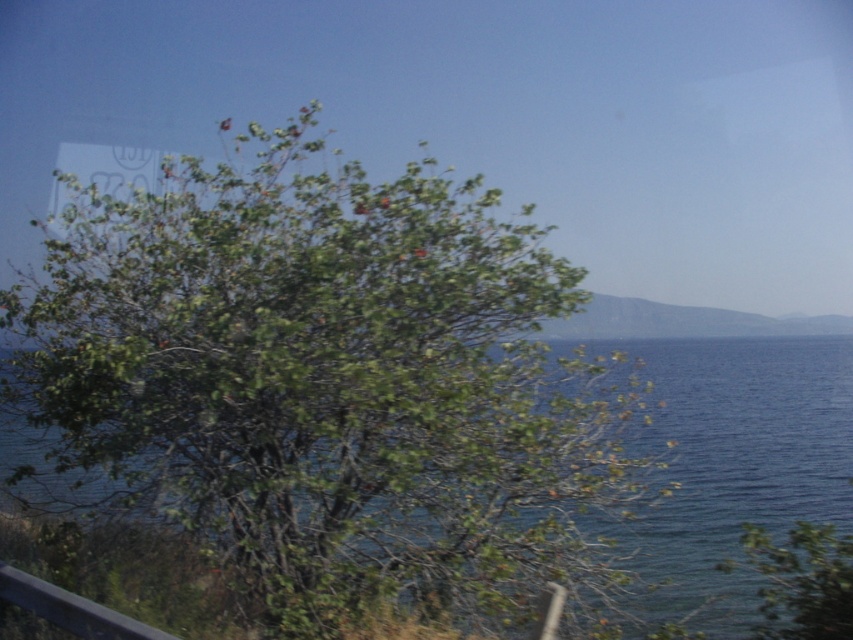
Between green leafy tree at center and dark gray metal rail at lower left, which one appears on the right side from the viewer's perspective?

Positioned to the right is green leafy tree at center.

Is green leafy tree at center behind dark gray metal rail at lower left?

Yes, it is behind dark gray metal rail at lower left.

Does point (346, 179) come behind point (74, 600)?

That is True.

Locate an element on the screen. The width and height of the screenshot is (853, 640). green leafy tree at center is located at coordinates (328, 385).

Locate an element on the screen. This screenshot has height=640, width=853. green leafy tree at center is located at coordinates (328, 385).

The width and height of the screenshot is (853, 640). What do you see at coordinates (328, 385) in the screenshot? I see `green leafy tree at center` at bounding box center [328, 385].

Locate an element on the screen. The width and height of the screenshot is (853, 640). green leafy tree at center is located at coordinates (328, 385).

Who is taller, blue liquid water at center or dark gray metal rail at lower left?

With more height is blue liquid water at center.

Who is positioned more to the right, blue liquid water at center or dark gray metal rail at lower left?

Positioned to the right is blue liquid water at center.

I want to click on blue liquid water at center, so (x=730, y=465).

Image resolution: width=853 pixels, height=640 pixels. What are the coordinates of `blue liquid water at center` in the screenshot? It's located at (730, 465).